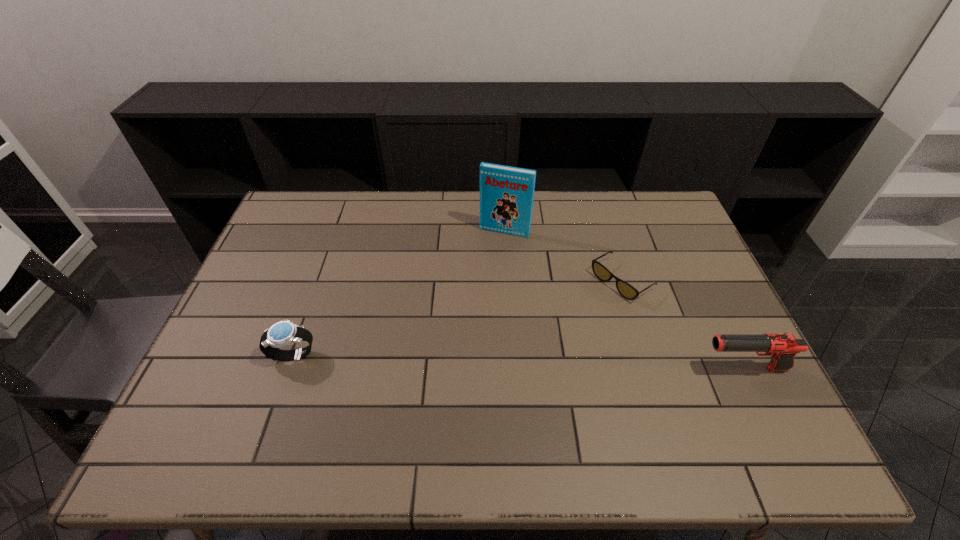
Locate an element on the screen. This screenshot has width=960, height=540. the leftmost object is located at coordinates (283, 333).

Where is `watch`? The width and height of the screenshot is (960, 540). watch is located at coordinates (283, 333).

Where is `gun`? gun is located at coordinates (782, 348).

I want to click on the third shortest object, so click(x=782, y=348).

Locate an element on the screen. Image resolution: width=960 pixels, height=540 pixels. the tallest object is located at coordinates (506, 193).

Identify the location of book. The image size is (960, 540). (506, 193).

Locate an element on the screen. The width and height of the screenshot is (960, 540). the shortest object is located at coordinates (626, 290).

Find the location of a particular element. This screenshot has width=960, height=540. the third nearest object is located at coordinates (626, 290).

Locate an element on the screen. The width and height of the screenshot is (960, 540). free point located on the right of the watch is located at coordinates (407, 354).

Where is `vacant area located 0.140m at the aiming end of the second tallest object`? vacant area located 0.140m at the aiming end of the second tallest object is located at coordinates (644, 369).